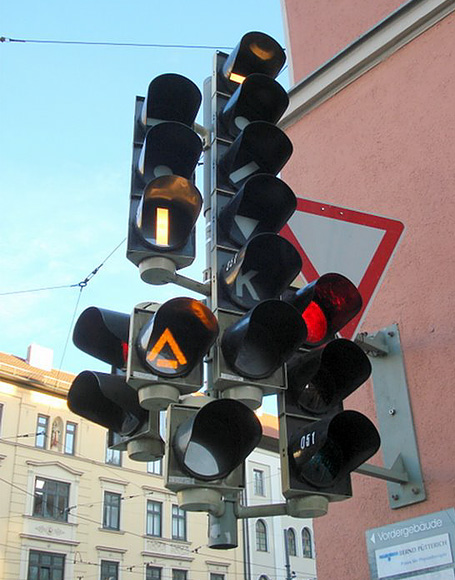
At what (x,y) coordinates should I click in order to perform the action: click on bracket. Please return your answer as a coordinate pair (x, y). Looking at the image, I should click on (393, 371).